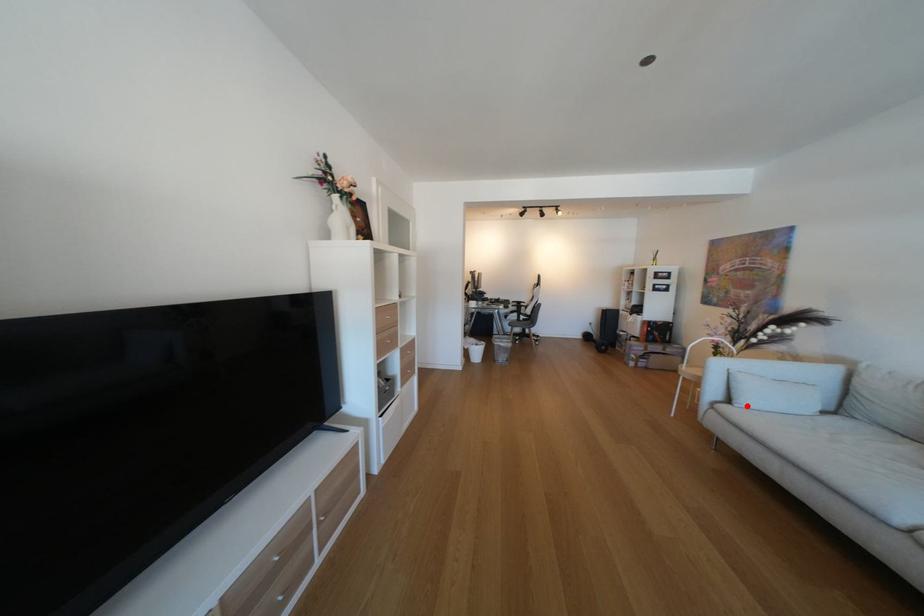
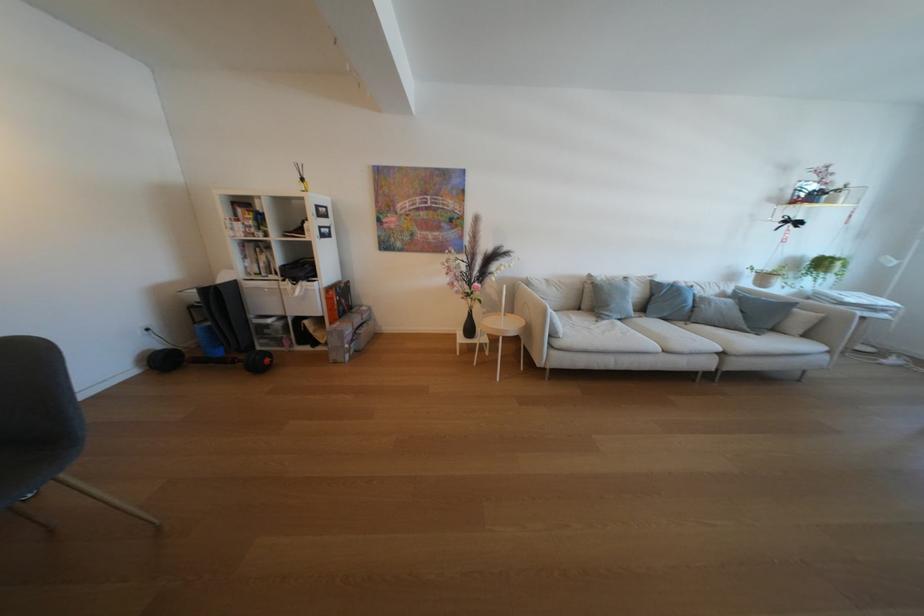
Where in the second image is the point corresponding to the highlighted location from the first image?

(572, 338)